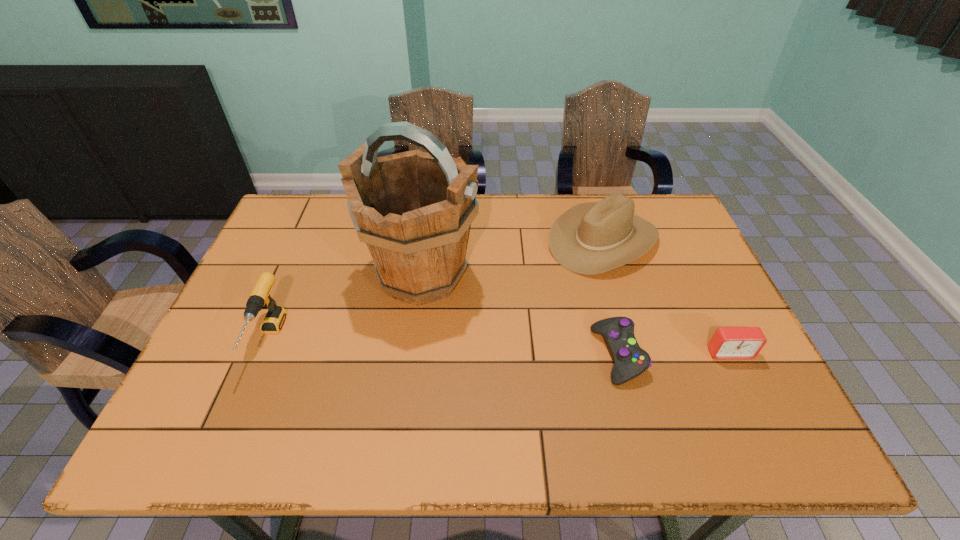
At what (x,y) coordinates should I click in order to perform the action: click on vacant area situated on the front of the shortest object. Please return your answer as a coordinate pair (x, y). Looking at the image, I should click on (633, 411).

Identify the location of bucket that is at the far edge. (413, 209).

This screenshot has width=960, height=540. I want to click on cowboy hat at the far edge, so click(x=591, y=238).

I want to click on object that is at the left edge, so click(259, 298).

The height and width of the screenshot is (540, 960). I want to click on cowboy hat present at the right edge, so pyautogui.click(x=591, y=238).

This screenshot has height=540, width=960. Find the location of `alarm clock at the right edge`. alarm clock at the right edge is located at coordinates (727, 342).

You are a GUI agent. You are given a task and a screenshot of the screen. Output one action in this format:
    pyautogui.click(x=<x>, y=<y>)
    Task: Click on the object that is at the far right corner
    This screenshot has height=540, width=960.
    Given the screenshot: What is the action you would take?
    pyautogui.click(x=591, y=238)

Where is `blank space at the far edge of the desktop`? The width and height of the screenshot is (960, 540). blank space at the far edge of the desktop is located at coordinates (351, 221).

Identify the location of free spot at the near edge of the desktop. (433, 448).

The height and width of the screenshot is (540, 960). In the image, there is a desktop. What are the coordinates of `vacant space at the left edge` in the screenshot? It's located at (289, 282).